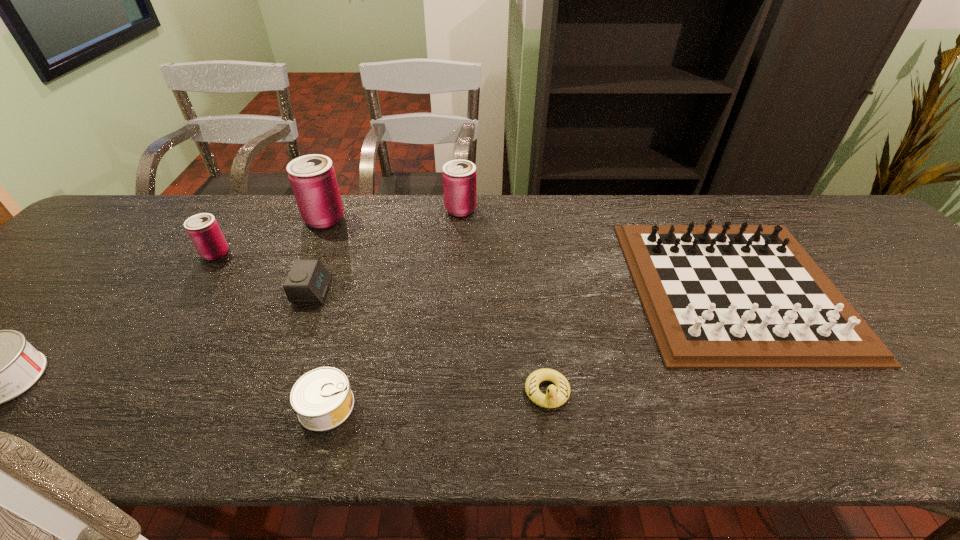
The height and width of the screenshot is (540, 960). What are the coordinates of `blank region between the second tallest can and the biggest pink can` in the screenshot? It's located at (393, 214).

Image resolution: width=960 pixels, height=540 pixels. What are the coordinates of `vacant space that is in between the shortest can and the rightmost object` in the screenshot? It's located at [530, 347].

Select which object appears as the closest to the leftmost can. Please provide its 2D coordinates. Your answer should be formatted as a tuple, i.e. [(x, y)], where the tuple contains the x and y coordinates of a point satisfying the conditions above.

[(203, 229)]

In order to click on object that can be found as the closest to the third can from right to left in this screenshot , I will do `click(203, 229)`.

You are a GUI agent. You are given a task and a screenshot of the screen. Output one action in this format:
    pyautogui.click(x=<x>, y=<y>)
    Task: Click on the can that is the fourth closest one to the fourth can from left to right
    The width and height of the screenshot is (960, 540).
    Given the screenshot: What is the action you would take?
    pyautogui.click(x=459, y=176)

Select which can appears as the second closest to the second object from left to right. Please provide its 2D coordinates. Your answer should be formatted as a tuple, i.e. [(x, y)], where the tuple contains the x and y coordinates of a point satisfying the conditions above.

[(0, 365)]

Locate an element on the screen. This screenshot has height=540, width=960. pink can that is the second closest to the rightmost can is located at coordinates (203, 229).

You are a GUI agent. You are given a task and a screenshot of the screen. Output one action in this format:
    pyautogui.click(x=<x>, y=<y>)
    Task: Click on the pink can that is the second closest to the alarm clock
    
    Given the screenshot: What is the action you would take?
    pyautogui.click(x=203, y=229)

Locate an element on the screen. The image size is (960, 540). free location that satisfies the following two spatial constraints: 1. on the back side of the third farthest can; 2. on the left side of the rightmost can is located at coordinates (246, 210).

You are a GUI agent. You are given a task and a screenshot of the screen. Output one action in this format:
    pyautogui.click(x=<x>, y=<y>)
    Task: Click on the vacant region that satisfies the following two spatial constraints: 1. on the front side of the fifth shortest object; 2. on the right side of the second biggest pink can
    The height and width of the screenshot is (540, 960).
    Given the screenshot: What is the action you would take?
    pyautogui.click(x=456, y=287)